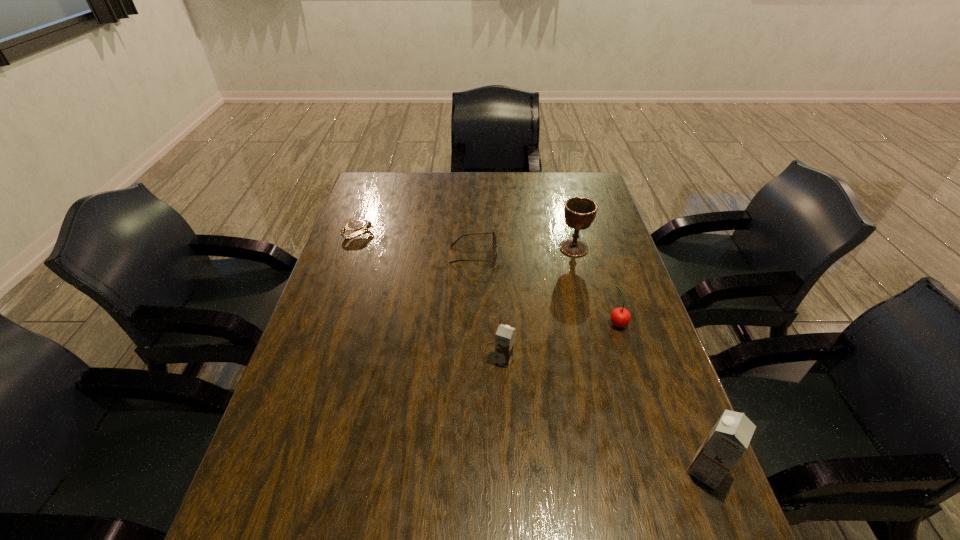
The image size is (960, 540). What are the coordinates of `the farther chocolate milk` in the screenshot? It's located at pos(505,336).

Identify the location of the shorter chocolate milk. The image size is (960, 540). (505, 336).

In order to click on the rightmost object in this screenshot , I will do `click(728, 440)`.

The height and width of the screenshot is (540, 960). Find the location of `the right chocolate milk`. the right chocolate milk is located at coordinates (728, 440).

Locate an element on the screen. Image resolution: width=960 pixels, height=540 pixels. chalice is located at coordinates (579, 212).

Where is `sunglasses`? sunglasses is located at coordinates (495, 241).

This screenshot has width=960, height=540. I want to click on the third nearest object, so click(x=620, y=317).

Identify the location of the leftmost object. (355, 225).

Identify the location of watch. (355, 225).

The height and width of the screenshot is (540, 960). Find the location of `blank space located 0.230m on the right of the shorter chocolate milk`. blank space located 0.230m on the right of the shorter chocolate milk is located at coordinates (606, 360).